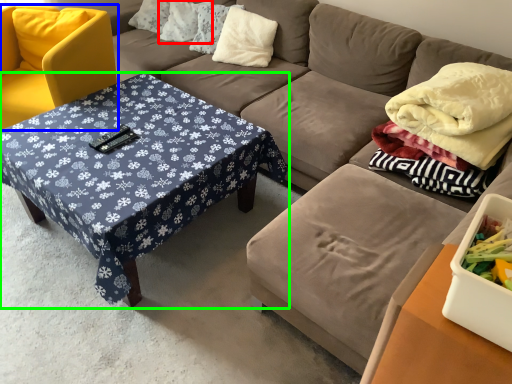
Question: Which is nearer to the pillow (highlighted by a red box)? chair (highlighted by a blue box) or coffee table (highlighted by a green box).

Choices:
 (A) chair
 (B) coffee table

Answer: (A)